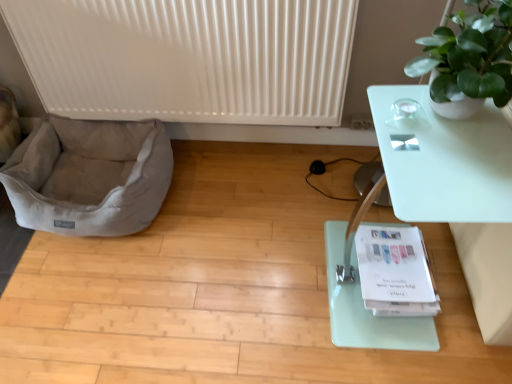
I want to click on vacant space in green matte plant at upper right (from a real-world perspective), so click(450, 120).